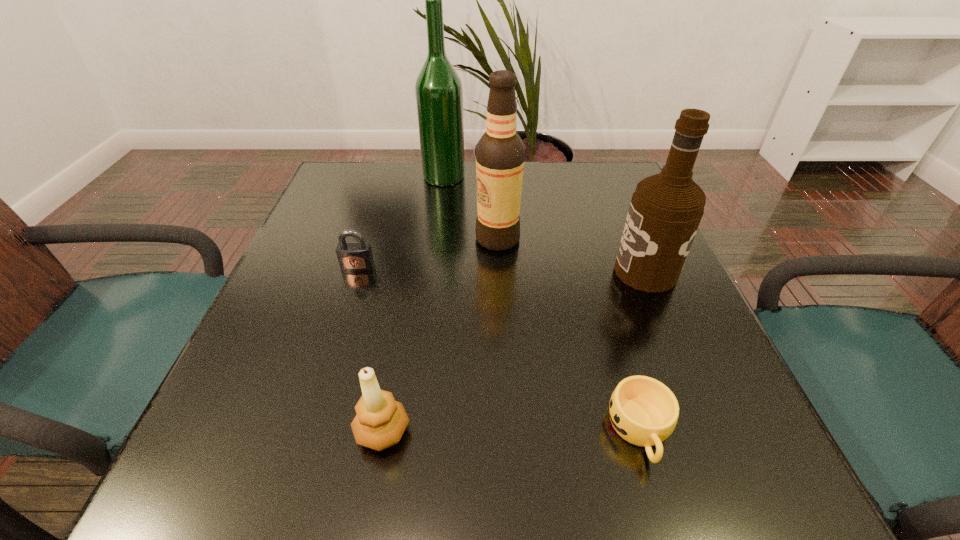
Identify the location of free space located 0.080m on the label of the fourth object from left to right. This screenshot has width=960, height=540. (440, 239).

Where is `free space located 0.120m on the label of the fourth object from left to right`? This screenshot has height=540, width=960. free space located 0.120m on the label of the fourth object from left to right is located at coordinates (421, 239).

The height and width of the screenshot is (540, 960). Find the location of `blank area located on the label of the rightmost alcohol`. blank area located on the label of the rightmost alcohol is located at coordinates (439, 272).

What are the coordinates of `vacant space situated 0.330m on the label of the rightmost alcohol` in the screenshot? It's located at (453, 272).

Where is `vacant space positioned 0.270m on the label of the rightmost alcohol`? This screenshot has height=540, width=960. vacant space positioned 0.270m on the label of the rightmost alcohol is located at coordinates [x=483, y=272].

Image resolution: width=960 pixels, height=540 pixels. Find the location of `vacant space located on the back of the third shortest object`. vacant space located on the back of the third shortest object is located at coordinates (395, 363).

The image size is (960, 540). In order to click on free location located 0.210m on the front of the padlock near the keyhole in this screenshot , I will do `click(329, 355)`.

Identify the location of vacant area located 0.070m on the right of the cup. The height and width of the screenshot is (540, 960). (720, 431).

The height and width of the screenshot is (540, 960). I want to click on object located in the far edge section of the desktop, so click(x=438, y=88).

Identify the location of candle_holder positioned at the near edge. The image size is (960, 540). (380, 421).